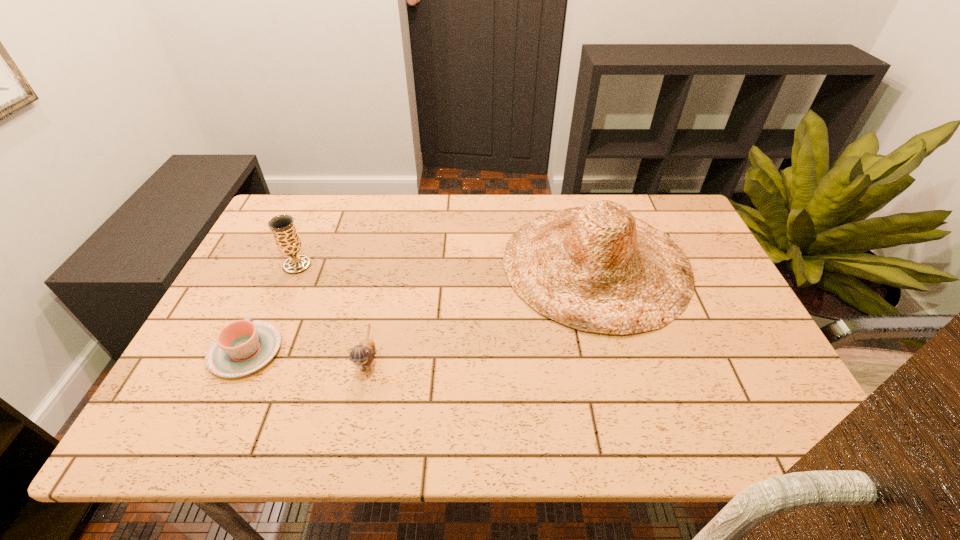
The height and width of the screenshot is (540, 960). What are the coordinates of `vacant space at the near left corner of the desktop` in the screenshot? It's located at (219, 434).

Where is `vacant space at the far right corner`? This screenshot has width=960, height=540. vacant space at the far right corner is located at coordinates (645, 205).

This screenshot has height=540, width=960. In order to click on vacant space at the near right corner of the desktop in this screenshot , I will do `click(784, 413)`.

Identify the location of free point between the third tallest object and the third shortest object. This screenshot has width=960, height=540. (332, 312).

At what (x,y) coordinates should I click in order to perform the action: click on vacant area that lies between the second tallest object and the kitten. Please return your answer as a coordinate pair (x, y). The image size is (960, 540). Looking at the image, I should click on (332, 312).

Identify the location of vacant area between the sunhat and the third object from left to right. coord(482,311).

In order to click on free space between the chalice and the shortest object in this screenshot , I will do `click(272, 308)`.

Image resolution: width=960 pixels, height=540 pixels. Identify the location of vacant space in between the rightmost object and the second tallest object. (446, 265).

You are a GUI agent. You are given a task and a screenshot of the screen. Output one action in this format:
    pyautogui.click(x=<x>, y=<y>)
    Task: Click on the vacant space in between the shortest object and the third tallest object
    The height and width of the screenshot is (540, 960).
    Given the screenshot: What is the action you would take?
    pyautogui.click(x=307, y=355)

This screenshot has width=960, height=540. In order to click on unoccupied area between the sunhat and the second object from right to left in this screenshot , I will do `click(482, 311)`.